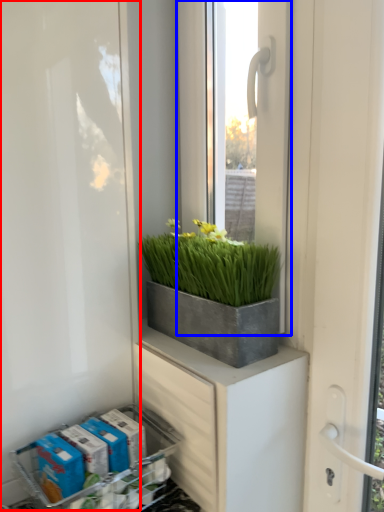
Question: Which object is closer to the camera taking this photo, screen door (highlighted by a red box) or window (highlighted by a blue box)?

Choices:
 (A) screen door
 (B) window

Answer: (A)